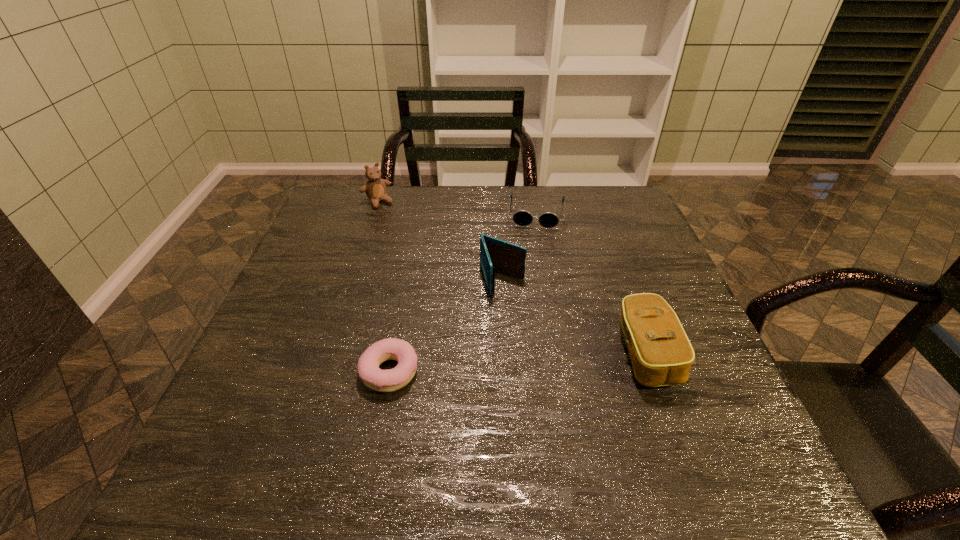
Find the location of a particular element. Image resolution: width=960 pixels, height=540 pixels. the fourth object from right to left is located at coordinates (390, 380).

In order to click on the shortest object in this screenshot , I will do (390, 380).

What are the coordinates of `clutch bag` in the screenshot? It's located at (661, 354).

Where is `the leftmost object`? The width and height of the screenshot is (960, 540). the leftmost object is located at coordinates (375, 189).

The width and height of the screenshot is (960, 540). In order to click on sunglasses in this screenshot , I will do `click(521, 217)`.

Where is `the third nearest object`? This screenshot has height=540, width=960. the third nearest object is located at coordinates click(496, 255).

Image resolution: width=960 pixels, height=540 pixels. What are the coordinates of `free space located on the right of the doughnut` in the screenshot? It's located at (588, 371).

What are the coordinates of `vacant area situated 0.180m on the front-facing side of the teddy bear` in the screenshot? It's located at (410, 239).

The width and height of the screenshot is (960, 540). I want to click on free space located 0.210m on the front-facing side of the teddy bear, so click(x=415, y=245).

Locate an element on the screen. free point located 0.380m on the front-facing side of the teddy bear is located at coordinates (444, 280).